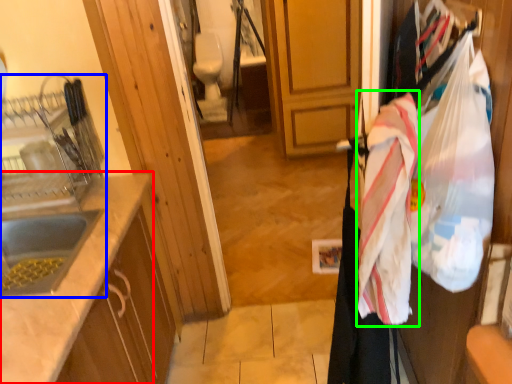
Question: Which object is the farthest from countertop (highlighted by a red box)? Choose among these: sink (highlighted by a blue box) or blanket (highlighted by a green box).

Choices:
 (A) sink
 (B) blanket

Answer: (B)